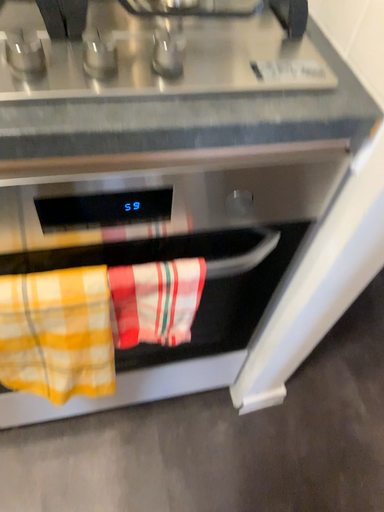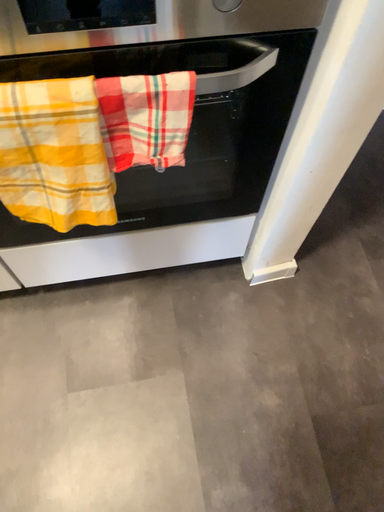
Question: How did the camera likely rotate when shooting the video?

Choices:
 (A) rotated upward
 (B) rotated downward

Answer: (B)